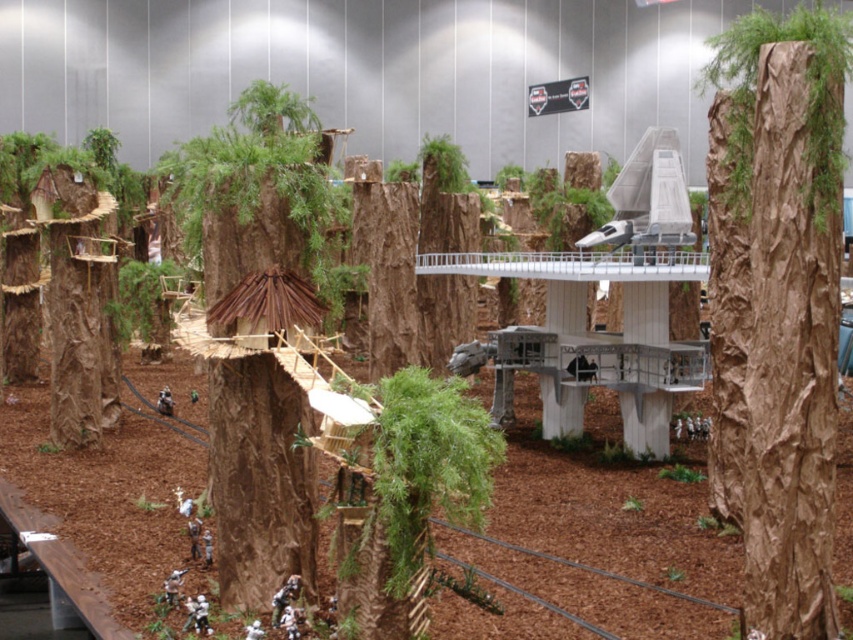
Question: Which point is closer to the camera?

Choices:
 (A) (230, 605)
 (B) (412, 538)

Answer: (B)

Question: Does brown textured tree trunk at center lie behind metallic silver fighter jet at center?

Choices:
 (A) no
 (B) yes

Answer: (A)

Question: Can you confirm if brown textured tree trunk at center is positioned to the left of green mossy tree at center?

Choices:
 (A) no
 (B) yes

Answer: (B)

Question: Can you confirm if brown textured bark at center is thinner than brown textured tree trunk at center?

Choices:
 (A) yes
 (B) no

Answer: (A)

Question: Which point is closer to the camera?

Choices:
 (A) brown textured bark at center
 (B) brown textured tree trunk at center
 (C) green mossy tree at center

Answer: (C)

Question: Among these points, which one is nearest to the camera?

Choices:
 (A) (399, 467)
 (B) (285, 454)
 (C) (787, 124)

Answer: (A)